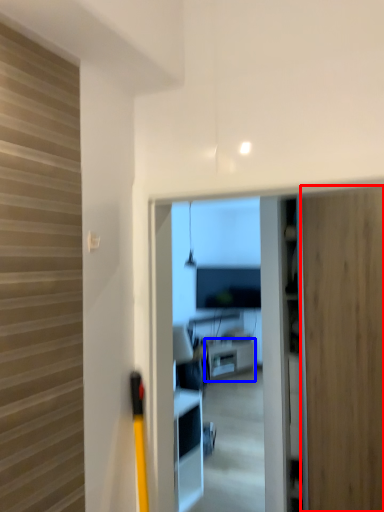
Question: Which object is closer to the camera taking this photo, door (highlighted by a red box) or furniture (highlighted by a blue box)?

Choices:
 (A) door
 (B) furniture

Answer: (A)